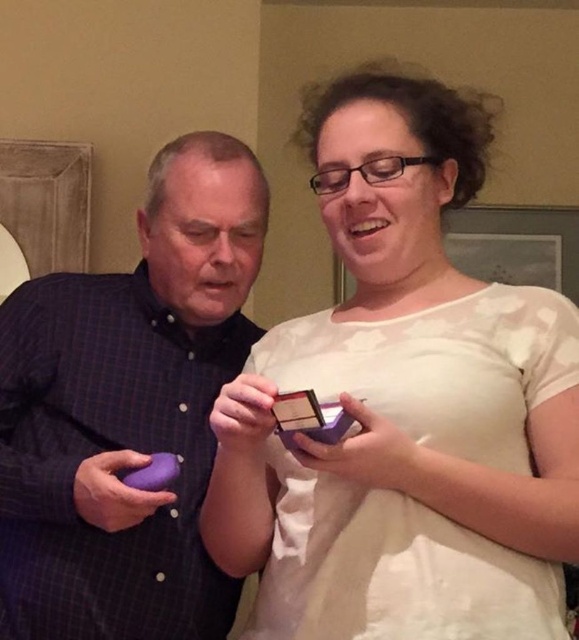
Question: Which point is farther from the camera taking this photo?

Choices:
 (A) (14, 548)
 (B) (373, 560)

Answer: (A)

Question: Which point is farther to the camera?

Choices:
 (A) purple matte phone at left
 (B) matte purple box at center

Answer: (A)

Question: Does matte purple box at center have a smaller size compared to purple matte phone at left?

Choices:
 (A) yes
 (B) no

Answer: (B)

Question: Can you confirm if matte purple box at center is positioned to the right of purple matte phone at left?

Choices:
 (A) no
 (B) yes

Answer: (B)

Question: Is matte purple box at center smaller than purple matte phone at left?

Choices:
 (A) no
 (B) yes

Answer: (A)